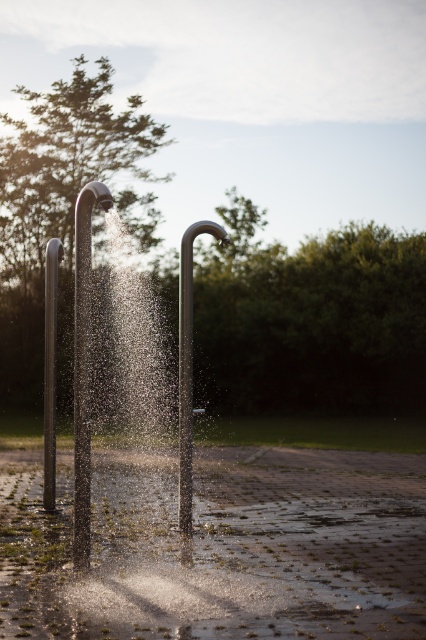
From the picture: Is satin silver shower head at center thinner than satin silver pole at left?

Correct, satin silver shower head at center's width is less than satin silver pole at left's.

Image resolution: width=426 pixels, height=640 pixels. Find the location of `satin silver shower head at center`. satin silver shower head at center is located at coordinates (83, 365).

Locate an element on the screen. satin silver shower head at center is located at coordinates (83, 365).

Is polished stainless steel shower head at center smaller than satin silver pole at left?

Correct, polished stainless steel shower head at center occupies less space than satin silver pole at left.

Between point (222, 241) and point (46, 378), which one is positioned behind?

Positioned behind is point (46, 378).

Between point (181, 308) and point (45, 284), which one is positioned behind?

Point (45, 284)

Find the location of a particular element. The image size is (426, 640). polished stainless steel shower head at center is located at coordinates coord(187,364).

Where is `satin silver shower head at center`? The height and width of the screenshot is (640, 426). satin silver shower head at center is located at coordinates (83, 365).

Who is more distant from viewer, [74,365] or [187,252]?

Positioned behind is point [187,252].

Where is `satin silver shower head at center`? This screenshot has height=640, width=426. satin silver shower head at center is located at coordinates (83, 365).